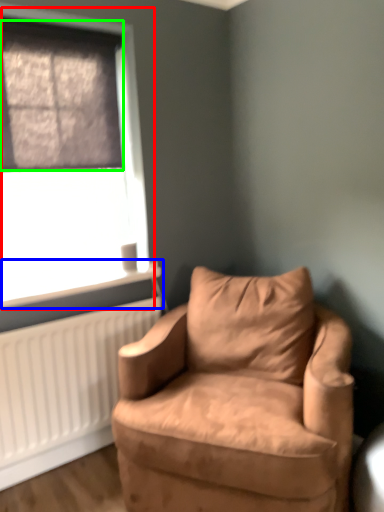
Question: Estimate the real-world distances between objects in this image. Which object is closer to window (highlighted by a red box), window sill (highlighted by a blue box) or window screen (highlighted by a green box)?

Choices:
 (A) window sill
 (B) window screen

Answer: (B)